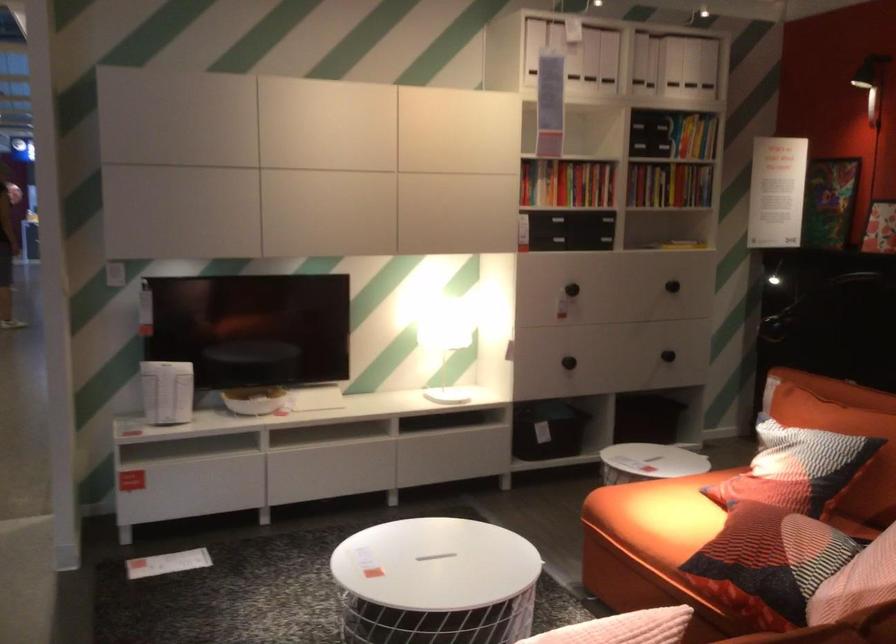
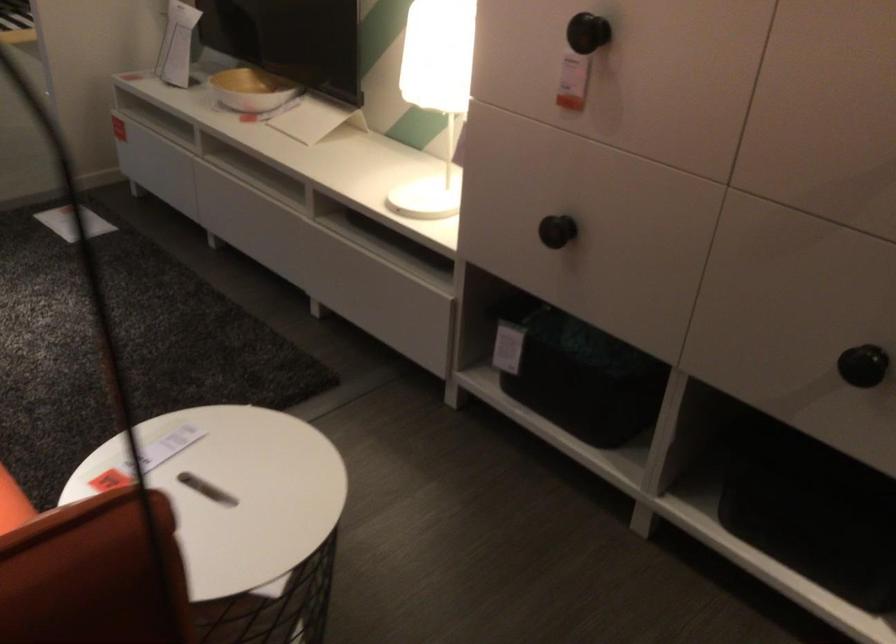
Where in the second image is the point corresponding to [484,330] from the first image?

(435, 93)